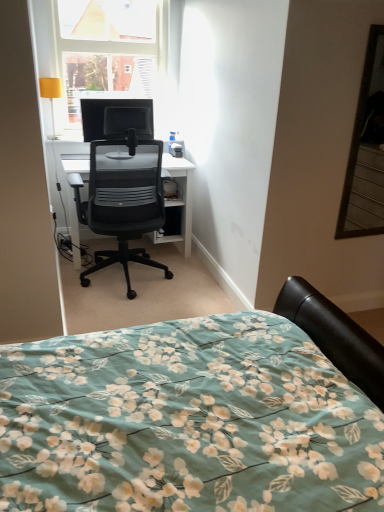
Question: Could you tell me if yellow fabric lampshade at upper left is facing black mesh chair at center?

Choices:
 (A) no
 (B) yes

Answer: (B)

Question: Is yellow fabric lampshade at upper left shorter than black mesh chair at center?

Choices:
 (A) no
 (B) yes

Answer: (B)

Question: From the image's perspective, does yellow fabric lampshade at upper left appear lower than black mesh chair at center?

Choices:
 (A) no
 (B) yes

Answer: (A)

Question: Would you say yellow fabric lampshade at upper left is outside black mesh chair at center?

Choices:
 (A) no
 (B) yes

Answer: (B)

Question: Is yellow fabric lampshade at upper left surrounding black mesh chair at center?

Choices:
 (A) no
 (B) yes

Answer: (A)

Question: Is black mesh chair at center taller or shorter than matte black monitor at upper center?

Choices:
 (A) short
 (B) tall

Answer: (B)

Question: Considering their positions, is black mesh chair at center located in front of or behind matte black monitor at upper center?

Choices:
 (A) behind
 (B) front

Answer: (B)

Question: From a real-world perspective, is black mesh chair at center positioned above or below matte black monitor at upper center?

Choices:
 (A) below
 (B) above

Answer: (A)

Question: From the image's perspective, is black mesh chair at center above or below matte black monitor at upper center?

Choices:
 (A) below
 (B) above

Answer: (A)

Question: Do you think yellow fabric lampshade at upper left is within matte black monitor at upper center, or outside of it?

Choices:
 (A) outside
 (B) inside

Answer: (A)

Question: Is yellow fabric lampshade at upper left wider or thinner than matte black monitor at upper center?

Choices:
 (A) wide
 (B) thin

Answer: (A)

Question: Is point (57, 79) closer or farther from the camera than point (147, 104)?

Choices:
 (A) farther
 (B) closer

Answer: (A)

Question: From the image's perspective, is yellow fabric lampshade at upper left positioned above or below matte black monitor at upper center?

Choices:
 (A) above
 (B) below

Answer: (A)

Question: In terms of height, does transparent glass window at upper left look taller or shorter compared to matte black monitor at upper center?

Choices:
 (A) short
 (B) tall

Answer: (B)

Question: Is transparent glass window at upper left to the left or to the right of matte black monitor at upper center in the image?

Choices:
 (A) right
 (B) left

Answer: (B)